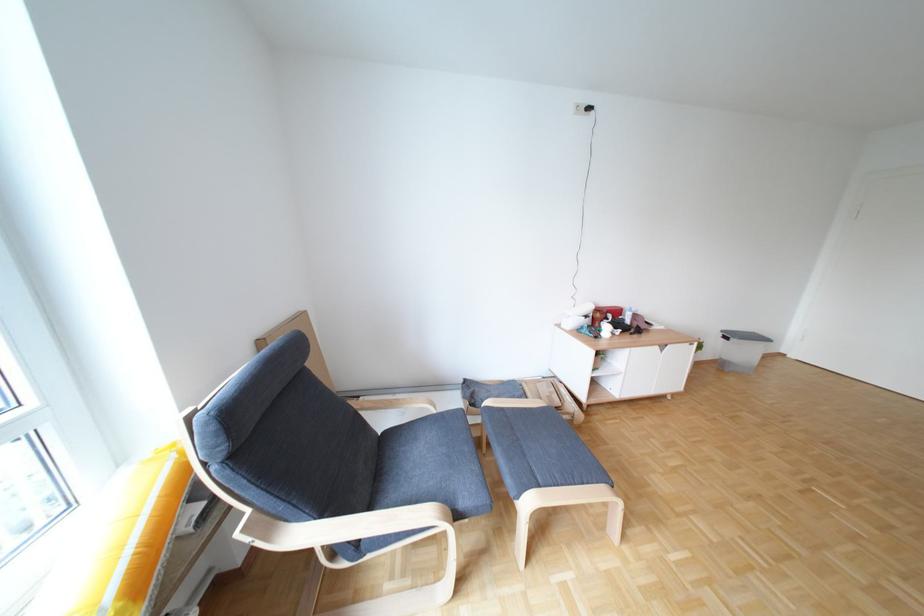
Where is `cardboard box`? The height and width of the screenshot is (616, 924). cardboard box is located at coordinates (299, 342).